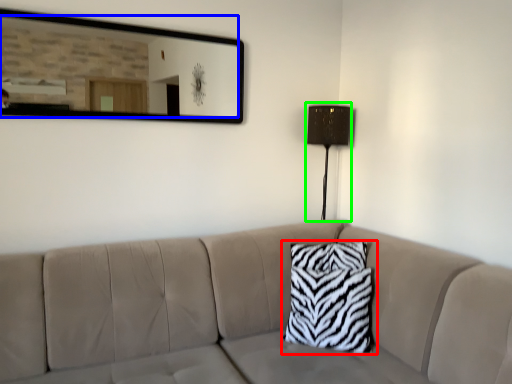
Question: Which is farther away from pillow (highlighted by a red box)? mirror (highlighted by a blue box) or table lamp (highlighted by a green box)?

Choices:
 (A) mirror
 (B) table lamp

Answer: (A)